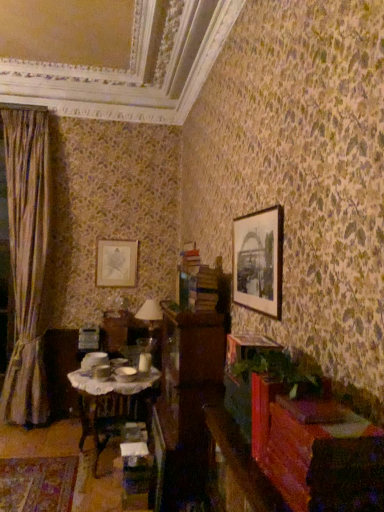
Where is `silky beige curtain at left`? The width and height of the screenshot is (384, 512). silky beige curtain at left is located at coordinates (27, 261).

The image size is (384, 512). I want to click on wooden dresser at center, so click(187, 387).

Describe the element at coordinates (187, 387) in the screenshot. The height and width of the screenshot is (512, 384). I see `wooden dresser at center` at that location.

You are a GUI agent. You are given a task and a screenshot of the screen. Output one action in this format:
    pyautogui.click(x=<x>, y=<y>)
    Task: Click on the matte gold picture frame at upper left, placed as the second picture frame when sorted from front to back
    Image resolution: width=384 pixels, height=512 pixels.
    Given the screenshot: What is the action you would take?
    pyautogui.click(x=116, y=263)

Could you tell me if matte gold picture frame at upper left, placed as the second picture frame when sorted from front to back, is facing silky beige curtain at left?

No, matte gold picture frame at upper left, placed as the second picture frame when sorted from front to back, is not aimed at silky beige curtain at left.

This screenshot has width=384, height=512. Find the location of `the 1st picture frame positioned above the silky beige curtain at left (from a real-world perspective)`. the 1st picture frame positioned above the silky beige curtain at left (from a real-world perspective) is located at coordinates (116, 263).

From the image's perspective, is matte gold picture frame at upper left, the 2th picture frame from the right, on silky beige curtain at left?

Indeed, from the image's perspective, matte gold picture frame at upper left, the 2th picture frame from the right, is shown above silky beige curtain at left.

Would you say matte gold picture frame at upper left, which is counted as the 1th picture frame, starting from the left, is to the left or to the right of silky beige curtain at left in the picture?

Clearly, matte gold picture frame at upper left, which is counted as the 1th picture frame, starting from the left, is on the right of silky beige curtain at left in the image.

Considering the positions of objects silky beige curtain at left and matte black picture frame at upper right, the 2th picture frame in the back-to-front sequence, in the image provided, who is in front, silky beige curtain at left or matte black picture frame at upper right, the 2th picture frame in the back-to-front sequence,?

matte black picture frame at upper right, the 2th picture frame in the back-to-front sequence.

Visually, is silky beige curtain at left positioned to the left or to the right of matte black picture frame at upper right, positioned as the second picture frame in left-to-right order?

From the image, it's evident that silky beige curtain at left is to the left of matte black picture frame at upper right, positioned as the second picture frame in left-to-right order.

From a real-world perspective, is silky beige curtain at left above or below matte black picture frame at upper right, placed as the 1th picture frame when sorted from right to left?

From a real-world perspective, silky beige curtain at left is physically below matte black picture frame at upper right, placed as the 1th picture frame when sorted from right to left.

Could you tell me if silky beige curtain at left is facing matte black picture frame at upper right, the 1th picture frame viewed from the front?

No, silky beige curtain at left is not aimed at matte black picture frame at upper right, the 1th picture frame viewed from the front.

Is silky beige curtain at left shorter than matte glass table lamp at center?

No.

This screenshot has height=512, width=384. I want to click on table lamp that appears below the silky beige curtain at left (from the image's perspective), so click(x=149, y=326).

From a real-world perspective, is silky beige curtain at left positioned above or below matte glass table lamp at center?

Clearly, from a real-world perspective, silky beige curtain at left is above matte glass table lamp at center.

Considering the relative positions of matte glass table lamp at center and matte black picture frame at upper right, the 2th picture frame in the back-to-front sequence, in the image provided, is matte glass table lamp at center behind matte black picture frame at upper right, the 2th picture frame in the back-to-front sequence,?

Yes, the depth of matte glass table lamp at center is greater than that of matte black picture frame at upper right, the 2th picture frame in the back-to-front sequence.

Is matte glass table lamp at center facing towards matte black picture frame at upper right, placed as the 1th picture frame when sorted from right to left?

Yes.

What's the angular difference between matte glass table lamp at center and matte black picture frame at upper right, the 2th picture frame in the back-to-front sequence,'s facing directions?

85.1 degrees.

Which object is positioned more to the right, matte glass table lamp at center or matte black picture frame at upper right, the 1th picture frame viewed from the front?

From the viewer's perspective, matte black picture frame at upper right, the 1th picture frame viewed from the front, appears more on the right side.

Looking at this image, is matte gold picture frame at upper left, which is counted as the 1th picture frame, starting from the left, directly adjacent to matte glass table lamp at center?

matte gold picture frame at upper left, which is counted as the 1th picture frame, starting from the left, and matte glass table lamp at center are clearly separated.

How distant is matte gold picture frame at upper left, the first picture frame viewed from the back, from matte glass table lamp at center?

They are 1.09 meters apart.

Image resolution: width=384 pixels, height=512 pixels. What are the coordinates of `picture frame on the left of matte glass table lamp at center` in the screenshot? It's located at (116, 263).

Is matte gold picture frame at upper left, the 2th picture frame from the right, thinner than wooden dresser at center?

Yes, matte gold picture frame at upper left, the 2th picture frame from the right, is thinner than wooden dresser at center.

Does point (105, 286) lie in front of point (198, 400)?

No.

Which is behind, matte gold picture frame at upper left, placed as the second picture frame when sorted from front to back, or wooden dresser at center?

matte gold picture frame at upper left, placed as the second picture frame when sorted from front to back, is further away from the camera.

Which object is closer to the camera, wooden dresser at center or matte glass table lamp at center?

wooden dresser at center is closer to the camera.

The image size is (384, 512). I want to click on table lamp that is behind the wooden dresser at center, so click(149, 326).

From the image's perspective, does wooden dresser at center appear higher than matte glass table lamp at center?

Actually, wooden dresser at center appears below matte glass table lamp at center in the image.

Which point is more forward, (187,412) or (156,341)?

Positioned in front is point (187,412).

At what (x,y) coordinates should I click in order to perform the action: click on curtain in front of the matte gold picture frame at upper left, the first picture frame viewed from the back. Please return your answer as a coordinate pair (x, y). The height and width of the screenshot is (512, 384). Looking at the image, I should click on (27, 261).

Identify the location of picture frame that is the 2nd object located above the silky beige curtain at left (from the image's perspective). The width and height of the screenshot is (384, 512). (259, 261).

Looking at the image, which one is located closer to silky beige curtain at left, matte glass table lamp at center or wooden table with lace cloth at center?

wooden table with lace cloth at center lies closer to silky beige curtain at left than the other object.

Looking at the image, which one is located further to silky beige curtain at left, wooden table with lace cloth at center or matte glass table lamp at center?

Based on the image, matte glass table lamp at center appears to be further to silky beige curtain at left.

Estimate the real-world distances between objects in this image. Which object is further from silky beige curtain at left, matte black picture frame at upper right, placed as the 1th picture frame when sorted from right to left, or wooden dresser at center?

Among the two, matte black picture frame at upper right, placed as the 1th picture frame when sorted from right to left, is located further to silky beige curtain at left.

Estimate the real-world distances between objects in this image. Which object is further from matte glass table lamp at center, wooden table with lace cloth at center or silky beige curtain at left?

Among the two, silky beige curtain at left is located further to matte glass table lamp at center.

Considering their positions, is wooden table with lace cloth at center positioned further to matte gold picture frame at upper left, the first picture frame viewed from the back, than wooden dresser at center?

Among the two, wooden dresser at center is located further to matte gold picture frame at upper left, the first picture frame viewed from the back.

Considering their positions, is matte glass table lamp at center positioned further to matte gold picture frame at upper left, placed as the second picture frame when sorted from front to back, than matte black picture frame at upper right, the 2th picture frame in the back-to-front sequence?

Among the two, matte black picture frame at upper right, the 2th picture frame in the back-to-front sequence, is located further to matte gold picture frame at upper left, placed as the second picture frame when sorted from front to back.

Estimate the real-world distances between objects in this image. Which object is further from matte gold picture frame at upper left, which is counted as the 1th picture frame, starting from the left, wooden table with lace cloth at center or matte black picture frame at upper right, the 2th picture frame in the back-to-front sequence?

Among the two, matte black picture frame at upper right, the 2th picture frame in the back-to-front sequence, is located further to matte gold picture frame at upper left, which is counted as the 1th picture frame, starting from the left.

Based on their spatial positions, is silky beige curtain at left or wooden table with lace cloth at center further from wooden dresser at center?

Among the two, silky beige curtain at left is located further to wooden dresser at center.

Find the location of `dresser between matte black picture frame at upper right, the 2th picture frame in the back-to-front sequence, and wooden table with lace cloth at center, in the vertical direction`. dresser between matte black picture frame at upper right, the 2th picture frame in the back-to-front sequence, and wooden table with lace cloth at center, in the vertical direction is located at coordinates (187, 387).

Locate an element on the screen. curtain between matte black picture frame at upper right, positioned as the second picture frame in left-to-right order, and matte glass table lamp at center from front to back is located at coordinates (27, 261).

Where is `table lamp positioned between wooden dresser at center and matte gold picture frame at upper left, placed as the second picture frame when sorted from front to back, from near to far`? table lamp positioned between wooden dresser at center and matte gold picture frame at upper left, placed as the second picture frame when sorted from front to back, from near to far is located at coordinates (149, 326).

This screenshot has height=512, width=384. Find the location of `table between matte black picture frame at upper right, placed as the 1th picture frame when sorted from right to left, and matte gold picture frame at upper left, which is counted as the 1th picture frame, starting from the left, in the front-back direction`. table between matte black picture frame at upper right, placed as the 1th picture frame when sorted from right to left, and matte gold picture frame at upper left, which is counted as the 1th picture frame, starting from the left, in the front-back direction is located at coordinates (112, 403).